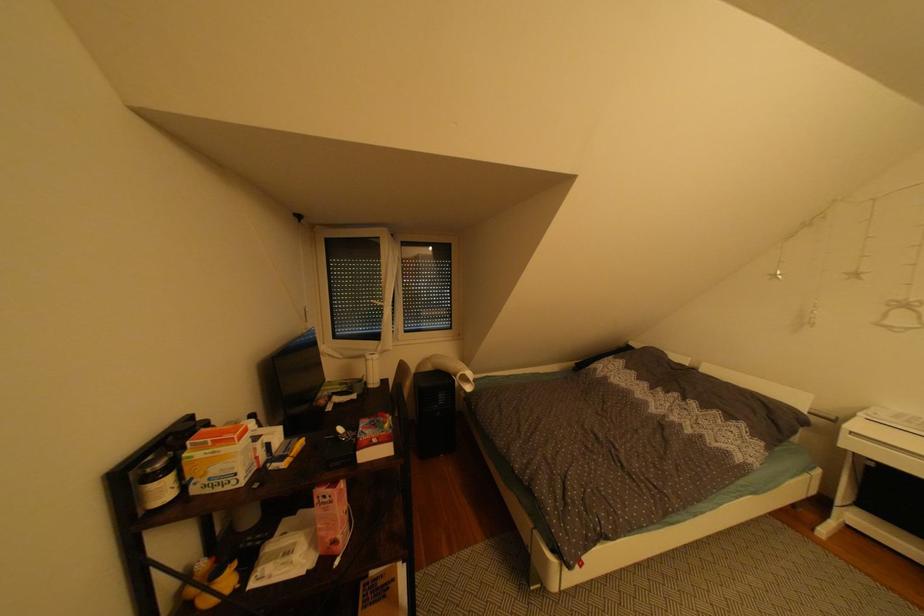
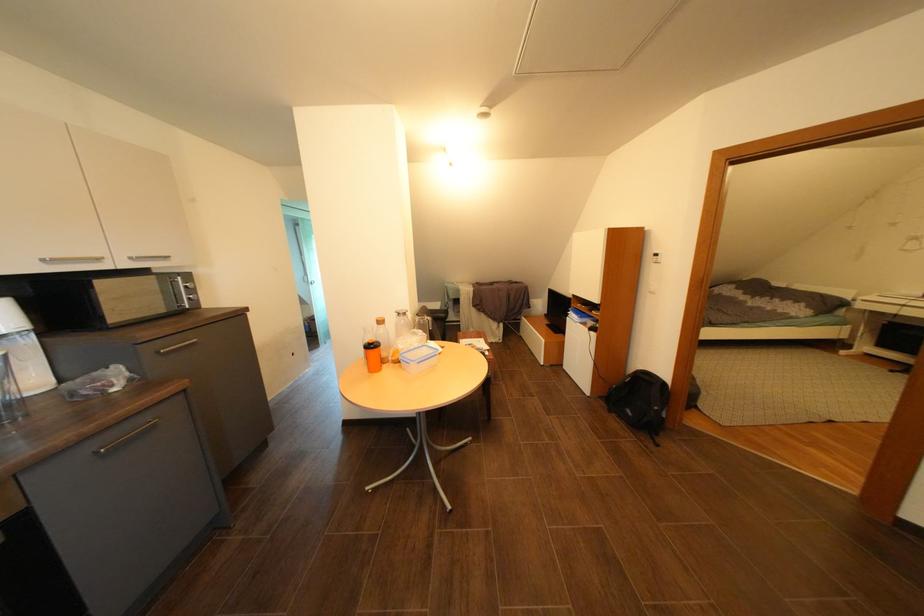
In the scene shown: What movement of the cameraman would produce the second image?

The cameraman walked toward left, backward.